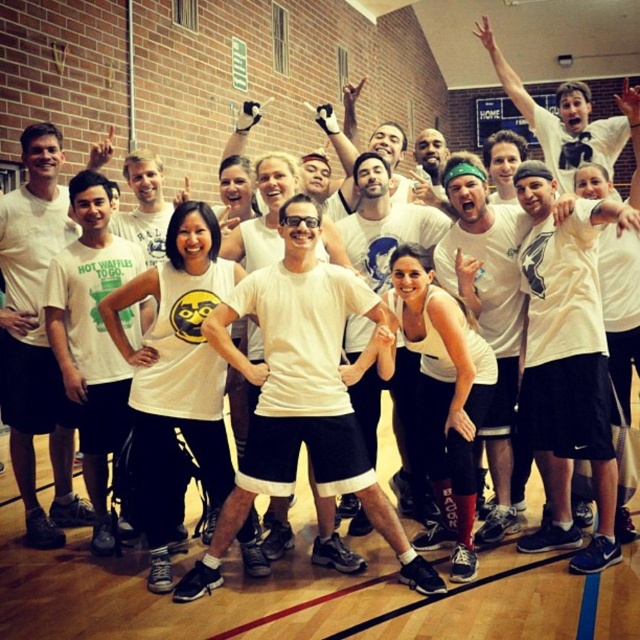
Does white matte t-shirt at center have a lesser height compared to matte white t-shirt at center?

Correct, white matte t-shirt at center is not as tall as matte white t-shirt at center.

Between white matte t-shirt at center and matte white t-shirt at center, which one has less height?

Standing shorter between the two is white matte t-shirt at center.

Is point (278, 348) positioned before point (16, 378)?

Yes, point (278, 348) is closer to viewer.

Identify the location of white matte t-shirt at center. This screenshot has width=640, height=640. pyautogui.click(x=301, y=394).